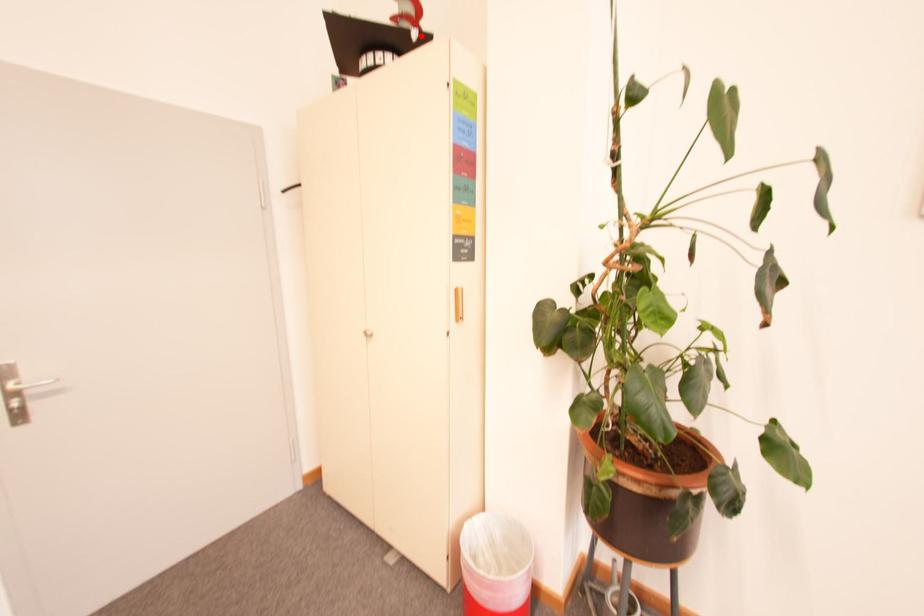
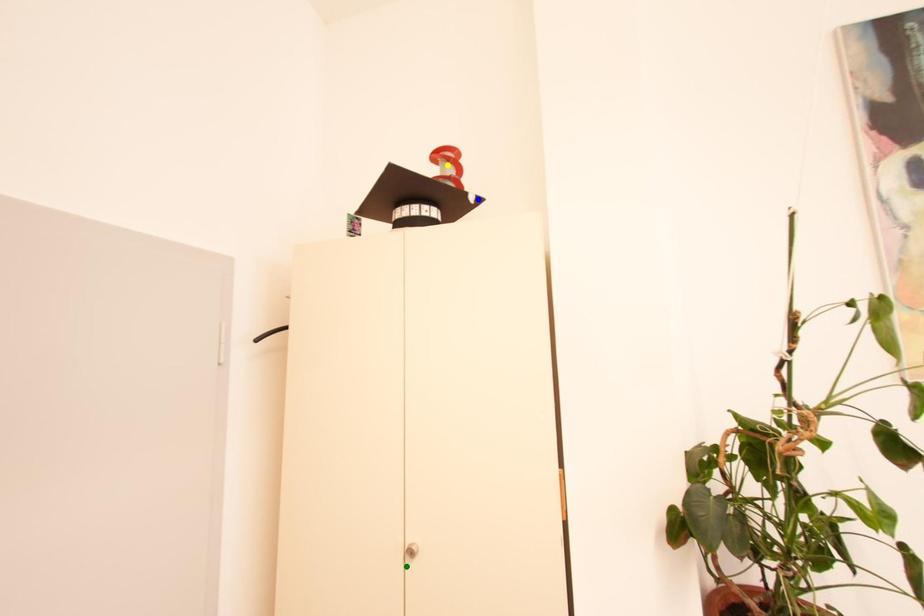
Question: I am providing you with two images of the same scene from different viewpoints. A red point is marked on the first image. You are given multiple points on the second image. Which point in image 2 is actually the same real-world point as the red point in image 1?

Choices:
 (A) yellow point
 (B) blue point
 (C) green point

Answer: (B)